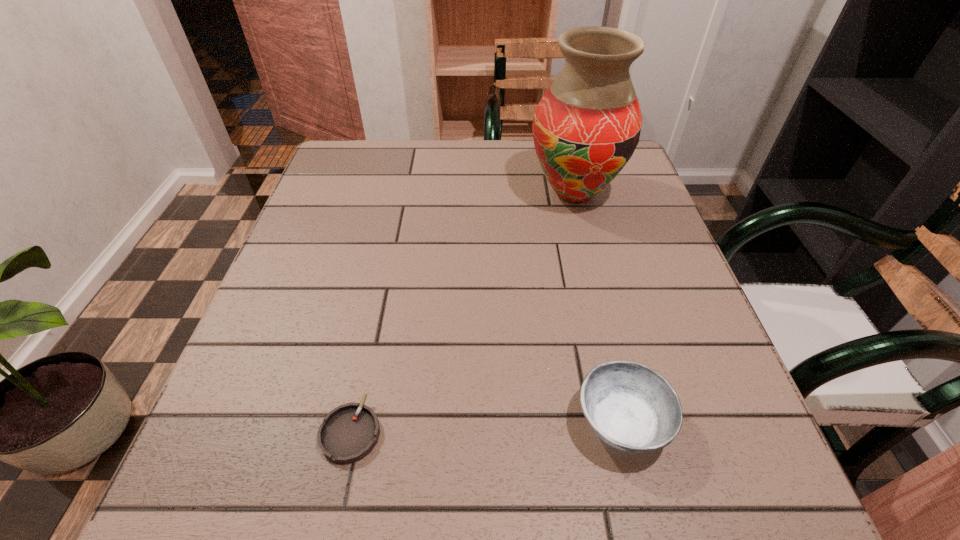
Locate an element on the screen. The width and height of the screenshot is (960, 540). vase that is at the right edge is located at coordinates (586, 127).

Image resolution: width=960 pixels, height=540 pixels. I want to click on ashtray at the right edge, so click(632, 408).

At what (x,y) coordinates should I click in order to perform the action: click on object located in the far right corner section of the desktop. Please return your answer as a coordinate pair (x, y). This screenshot has height=540, width=960. Looking at the image, I should click on (586, 127).

The height and width of the screenshot is (540, 960). In order to click on object at the near right corner in this screenshot , I will do `click(632, 408)`.

Image resolution: width=960 pixels, height=540 pixels. I want to click on vacant space at the far edge of the desktop, so click(x=461, y=147).

The image size is (960, 540). Identify the location of vacant space at the near edge of the desktop. 639,523.

The image size is (960, 540). I want to click on vacant space at the left edge of the desktop, so coord(312,297).

In the image, there is a desktop. At what (x,y) coordinates should I click in order to perform the action: click on vacant space at the right edge. Please return your answer as a coordinate pair (x, y). Looking at the image, I should click on (636, 246).

Locate an element on the screen. This screenshot has height=540, width=960. free space at the far left corner is located at coordinates tap(357, 188).

Where is `vacant space at the near left corner`? vacant space at the near left corner is located at coordinates (218, 480).